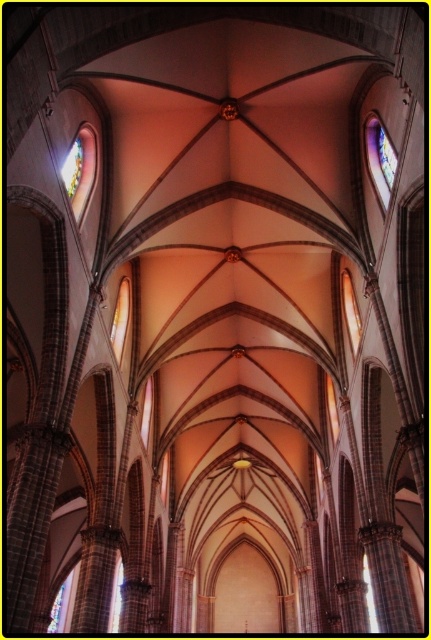
Question: Can you confirm if multicolored stained glass at upper right is positioned to the right of multicolored stained glass at upper left?

Choices:
 (A) no
 (B) yes

Answer: (B)

Question: Which of the following is the farthest from the observer?

Choices:
 (A) (71, 172)
 (B) (396, 154)

Answer: (A)

Question: Which object is farther from the camera taking this photo?

Choices:
 (A) multicolored stained glass at upper left
 (B) multicolored stained glass at upper right

Answer: (A)

Question: Where is multicolored stained glass at upper right located in relation to multicolored stained glass at upper left in the image?

Choices:
 (A) above
 (B) below

Answer: (A)

Question: Can you confirm if multicolored stained glass at upper right is wider than multicolored stained glass at upper left?

Choices:
 (A) yes
 (B) no

Answer: (A)